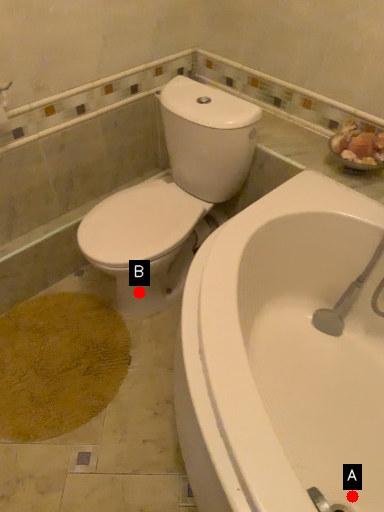
Question: Two points are circled on the image, labeled by A and B beside each circle. Which point is further to the camera?

Choices:
 (A) A is further
 (B) B is further

Answer: (B)